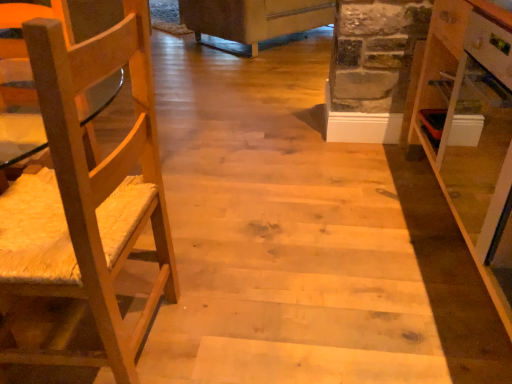
Question: Is point (238, 28) closer or farther from the camera than point (483, 223)?

Choices:
 (A) farther
 (B) closer

Answer: (A)

Question: Considering the relative positions of white fabric couch at upper center and white glossy cabinet at right in the image provided, is white fabric couch at upper center to the left or to the right of white glossy cabinet at right?

Choices:
 (A) right
 (B) left

Answer: (B)

Question: Considering the real-world distances, which object is farthest from the natural wood chair at left?

Choices:
 (A) white fabric couch at upper center
 (B) white glossy cabinet at right

Answer: (A)

Question: Which object is the closest to the natural wood chair at left?

Choices:
 (A) white fabric couch at upper center
 (B) white glossy cabinet at right

Answer: (B)